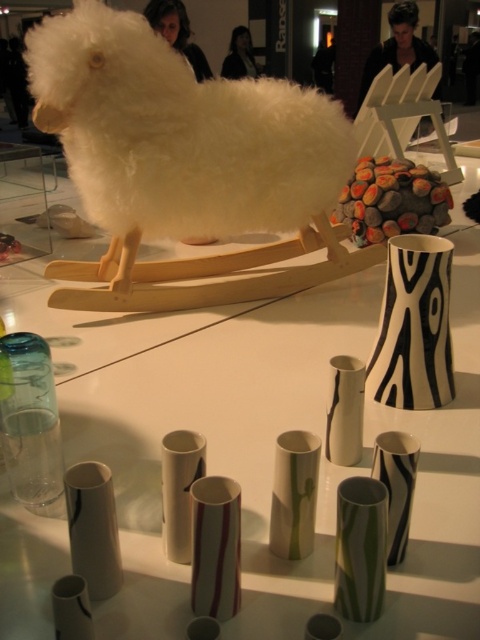
Question: Which point appears farthest from the camera in this image?

Choices:
 (A) (228, 205)
 (B) (425, 260)

Answer: (A)

Question: Considering the relative positions of white fluffy sheep at center and black and white striped vase at center right in the image provided, where is white fluffy sheep at center located with respect to black and white striped vase at center right?

Choices:
 (A) right
 (B) left

Answer: (B)

Question: Which object is farther from the camera taking this photo?

Choices:
 (A) black and white striped vase at center right
 (B) white fluffy sheep at center

Answer: (B)

Question: Does white fluffy sheep at center have a smaller size compared to black and white striped vase at center right?

Choices:
 (A) no
 (B) yes

Answer: (A)

Question: Is white fluffy sheep at center positioned at the back of black and white striped vase at center right?

Choices:
 (A) no
 (B) yes

Answer: (B)

Question: Which point is closer to the camera?

Choices:
 (A) (421, 372)
 (B) (59, 275)

Answer: (A)